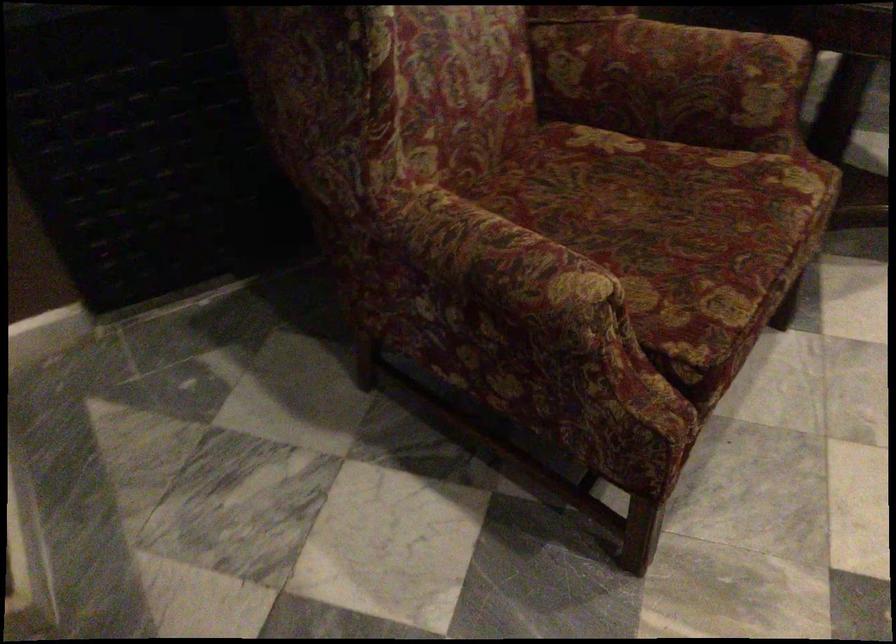
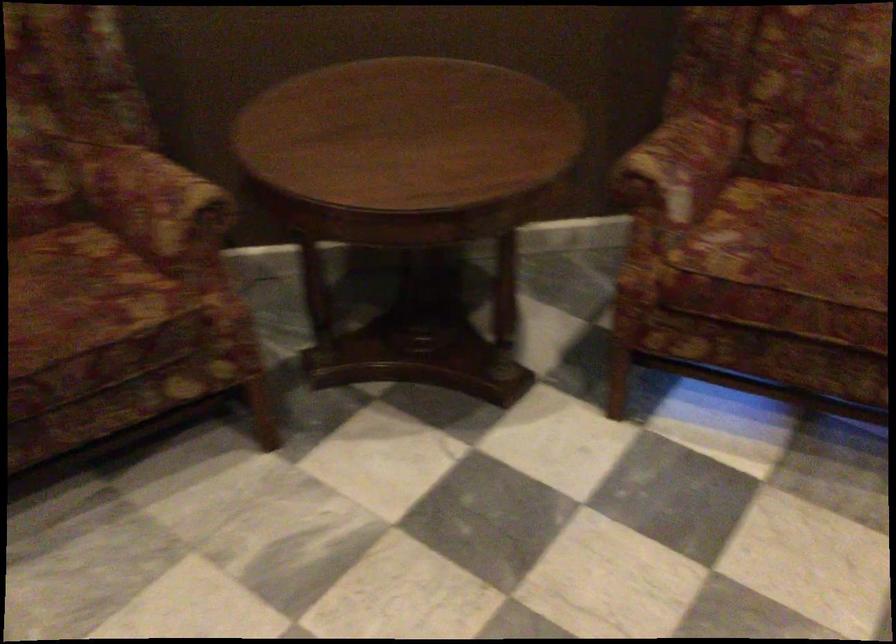
Where in the second image is the point corresponding to pixel 698 187 from the first image?

(80, 292)